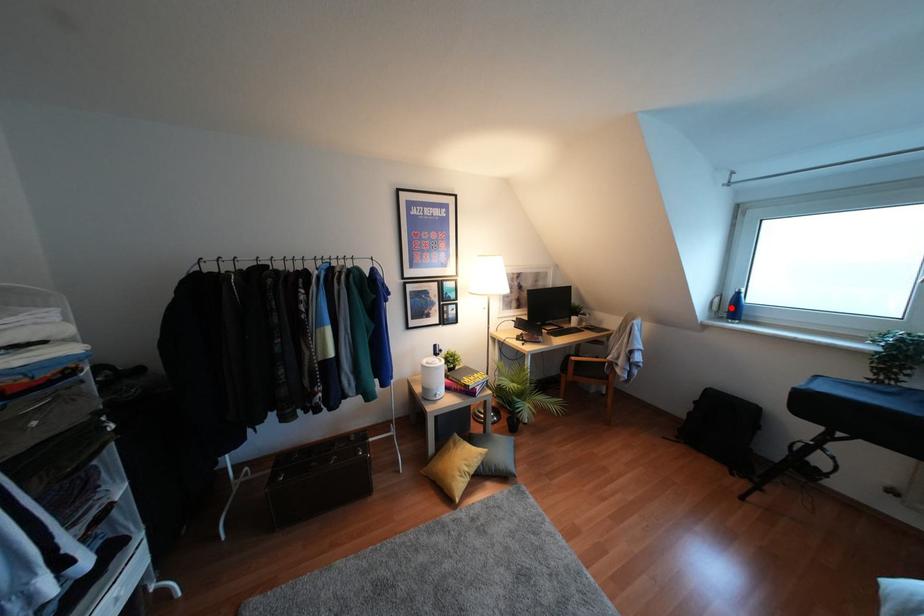
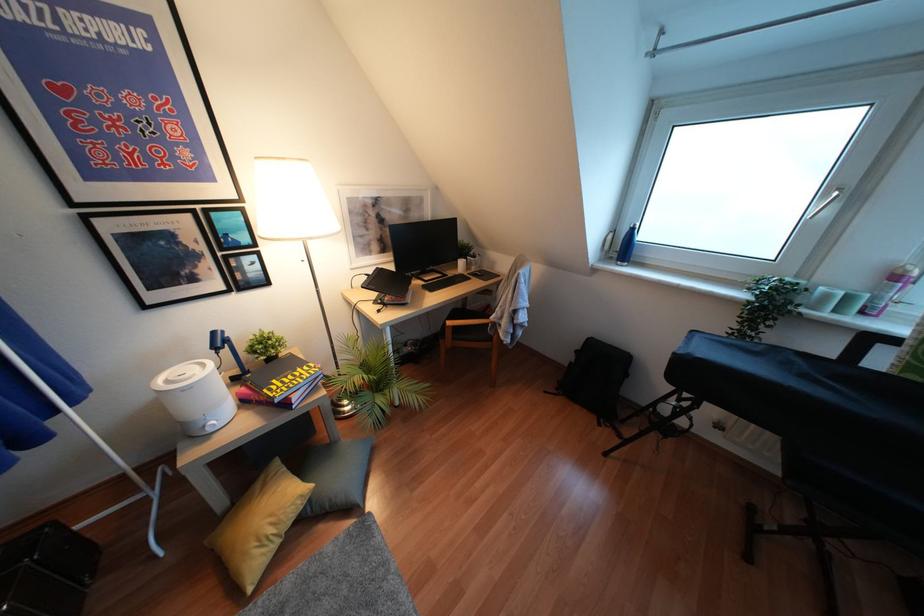
Locate, in the second image, the point that corresponds to the highlighted location in the first image.

(623, 246)